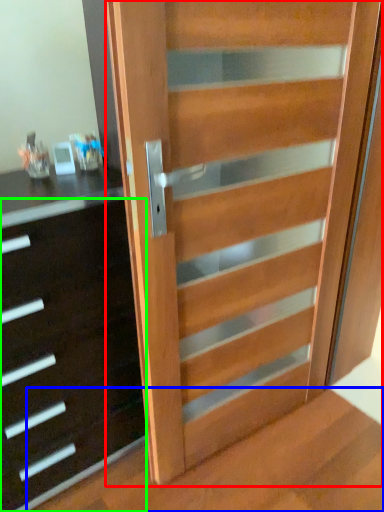
Question: Which is farther away from door (highlighted by a red box)? stairwell (highlighted by a blue box) or chest of drawers (highlighted by a green box)?

Choices:
 (A) stairwell
 (B) chest of drawers

Answer: (A)